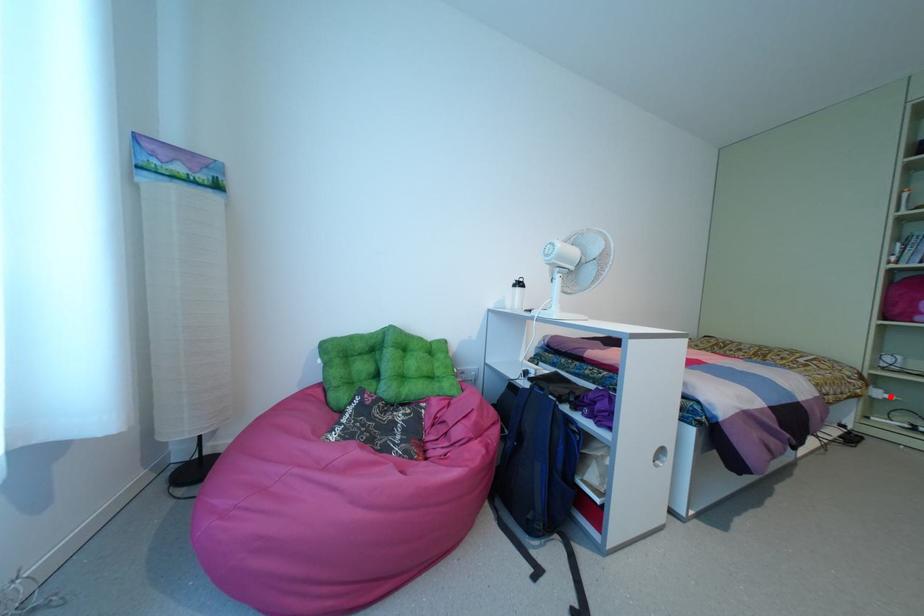
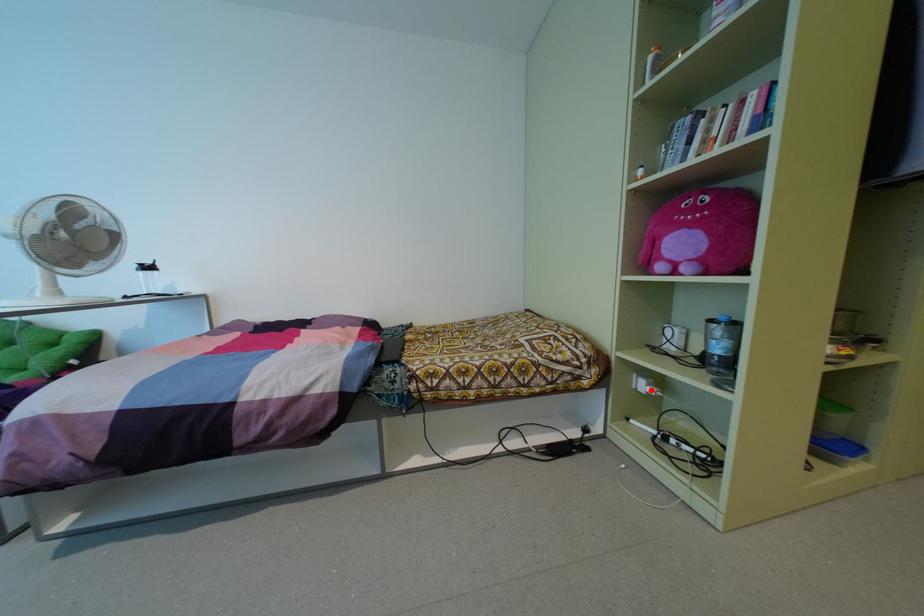
I am providing you with two images of the same scene from different viewpoints. A red point is marked on the first image and another point is marked on the second image. Does the point marked in image1 correspond to the same location as the one in image2?

Yes